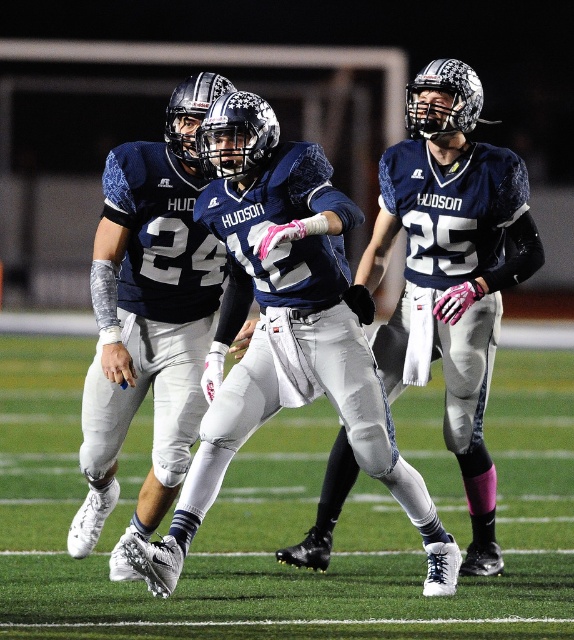
Question: Can you confirm if green turf at center is positioned to the left of matte blue jersey at center?

Choices:
 (A) yes
 (B) no

Answer: (A)

Question: Which of the following is the closest to the observer?

Choices:
 (A) (276, 397)
 (B) (381, 531)

Answer: (A)

Question: Is the position of green turf at center more distant than that of matte blue jersey at center?

Choices:
 (A) no
 (B) yes

Answer: (B)

Question: Does green turf at center appear over matte blue jersey at center?

Choices:
 (A) no
 (B) yes

Answer: (A)

Question: Which point is closer to the camera?

Choices:
 (A) (284, 588)
 (B) (262, 262)

Answer: (B)